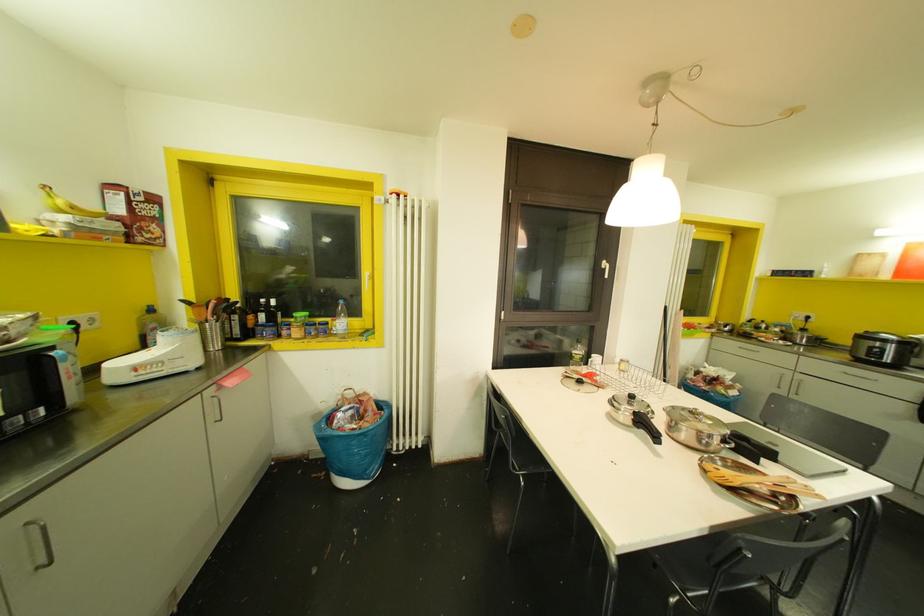
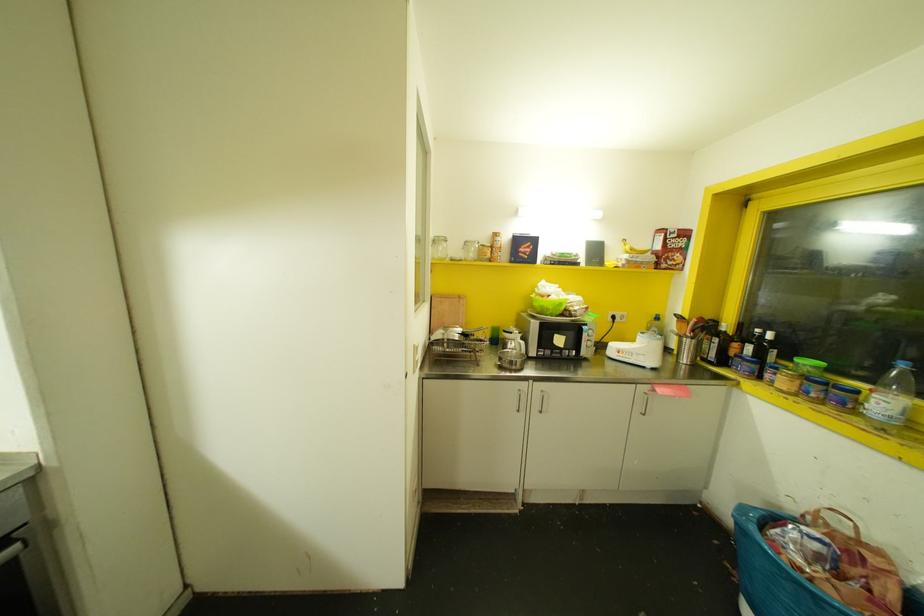
Locate, in the second image, the point that corresponds to point 261,315 in the first image.

(748, 347)